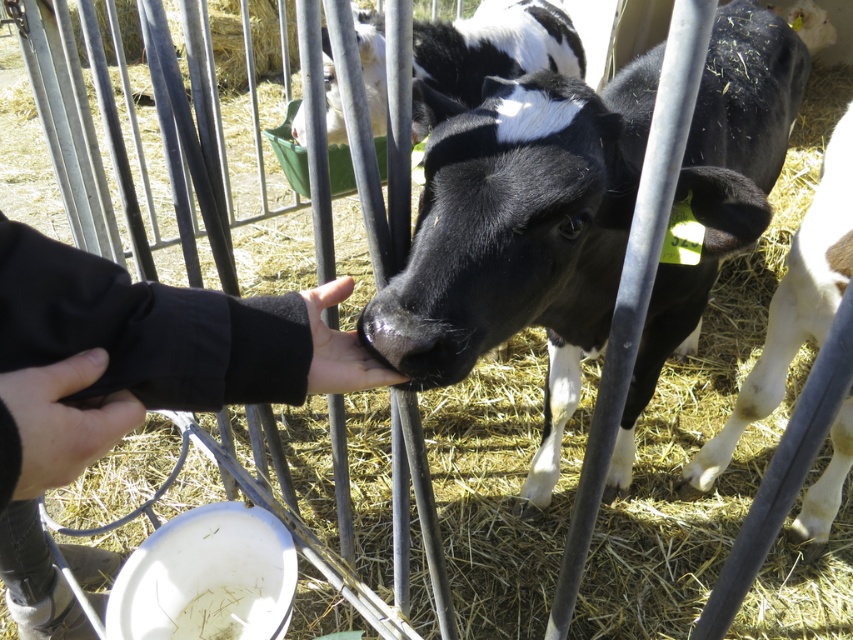
Question: Which object is farther from the camera taking this photo?

Choices:
 (A) black soft hand at center
 (B) black fleece sleeve at center
 (C) black smooth calf at center

Answer: (C)

Question: Does black soft hand at center appear on the right side of smooth skin hand at center?

Choices:
 (A) yes
 (B) no

Answer: (B)

Question: Which point is farther to the camera?

Choices:
 (A) (62, 385)
 (B) (740, 406)
 (C) (257, 308)

Answer: (B)

Question: Can you confirm if black and white fur at center is positioned to the right of smooth skin hand at center?

Choices:
 (A) yes
 (B) no

Answer: (A)

Question: Which object is closer to the camera taking this photo?

Choices:
 (A) black smooth calf at center
 (B) black and white fur at center
 (C) black and white cow at center
 (D) black fleece sleeve at center

Answer: (D)

Question: Can you confirm if black and white cow at center is positioned above black fleece sleeve at center?

Choices:
 (A) yes
 (B) no

Answer: (A)